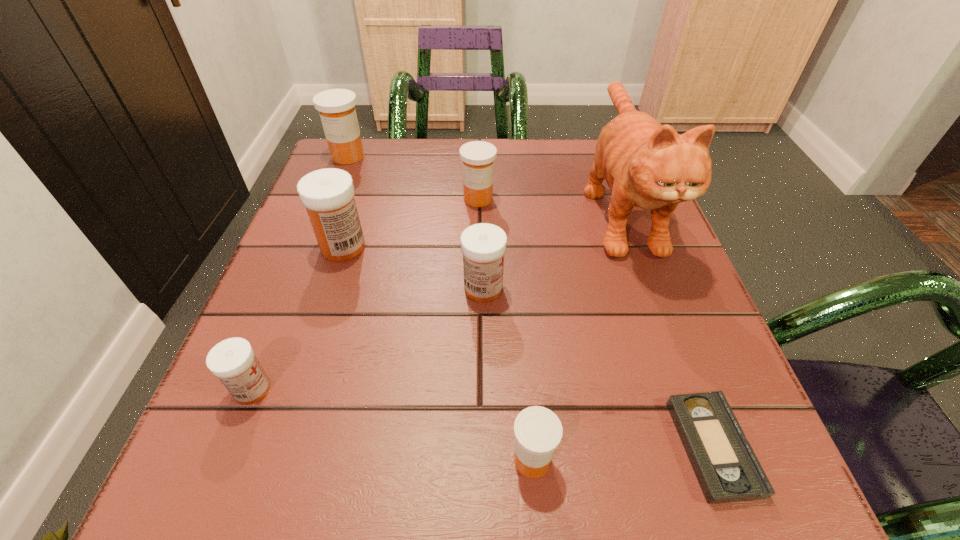
Locate an element on the screen. This screenshot has width=960, height=540. vacant region between the fifth farthest medicine and the biggest white medicine is located at coordinates (298, 318).

The width and height of the screenshot is (960, 540). Find the location of `free point between the leftmost orange medicine and the second nearest medicine`. free point between the leftmost orange medicine and the second nearest medicine is located at coordinates (300, 273).

The height and width of the screenshot is (540, 960). What are the coordinates of `free area in between the smallest orange medicine and the leftmost orange medicine` in the screenshot? It's located at (440, 308).

Locate an element on the screen. This screenshot has height=540, width=960. free point between the second farthest orange medicine and the leftmost orange medicine is located at coordinates (413, 178).

You are a GUI agent. You are given a task and a screenshot of the screen. Output one action in this format:
    pyautogui.click(x=<x>, y=<y>)
    Task: Click on the vacant area that lies between the nearest orange medicine and the tallest object
    
    Given the screenshot: What is the action you would take?
    pyautogui.click(x=576, y=333)

Image resolution: width=960 pixels, height=540 pixels. Find the location of `free space between the shortest object and the second farthest orange medicine`. free space between the shortest object and the second farthest orange medicine is located at coordinates (595, 323).

The image size is (960, 540). I want to click on object that is the closest to the second smallest orange medicine, so click(x=483, y=245).

In order to click on the fourth closest object to the shortest object in this screenshot , I will do pos(477,157).

Where is `the third closest medicine to the second farthest medicine`? The image size is (960, 540). the third closest medicine to the second farthest medicine is located at coordinates (336, 107).

Select which medicine is the second closest to the second smallest orange medicine. Please provide its 2D coordinates. Your answer should be formatted as a tuple, i.e. [(x, y)], where the tuple contains the x and y coordinates of a point satisfying the conditions above.

[(328, 194)]